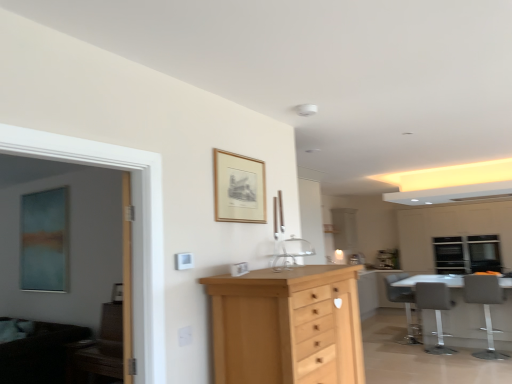
Question: Is there a large distance between transparent glass window at upper right and matte gray chair at lower right, placed as the 2th chair when sorted from back to front?

Choices:
 (A) no
 (B) yes

Answer: (B)

Question: Does transparent glass window at upper right appear on the left side of matte gray chair at lower right, placed as the 2th chair when sorted from back to front?

Choices:
 (A) no
 (B) yes

Answer: (A)

Question: Is transparent glass window at upper right at the right side of matte gray chair at lower right, placed as the 2th chair when sorted from back to front?

Choices:
 (A) yes
 (B) no

Answer: (A)

Question: Does transparent glass window at upper right have a greater height compared to matte gray chair at lower right, arranged as the 2th chair when viewed from the front?

Choices:
 (A) no
 (B) yes

Answer: (A)

Question: Is transparent glass window at upper right wider than matte gray chair at lower right, placed as the 2th chair when sorted from back to front?

Choices:
 (A) no
 (B) yes

Answer: (A)

Question: Considering the positions of wooden picture frame at upper center and clear glass sink at center in the image, is wooden picture frame at upper center wider or thinner than clear glass sink at center?

Choices:
 (A) thin
 (B) wide

Answer: (A)

Question: Considering their positions, is wooden picture frame at upper center located in front of or behind clear glass sink at center?

Choices:
 (A) behind
 (B) front

Answer: (B)

Question: From the image's perspective, is wooden picture frame at upper center positioned above or below clear glass sink at center?

Choices:
 (A) above
 (B) below

Answer: (A)

Question: Is wooden picture frame at upper center to the left or to the right of clear glass sink at center in the image?

Choices:
 (A) left
 (B) right

Answer: (A)

Question: Is point (289, 241) positioned closer to the camera than point (408, 225)?

Choices:
 (A) closer
 (B) farther

Answer: (A)

Question: In the image, is clear glass sink at center on the left side or the right side of white glossy cabinetry at right?

Choices:
 (A) right
 (B) left

Answer: (B)

Question: Is clear glass sink at center spatially inside white glossy cabinetry at right, or outside of it?

Choices:
 (A) inside
 (B) outside

Answer: (B)

Question: Considering the positions of clear glass sink at center and white glossy cabinetry at right in the image, is clear glass sink at center taller or shorter than white glossy cabinetry at right?

Choices:
 (A) short
 (B) tall

Answer: (A)

Question: Is gray fabric chair at lower right, the first chair from the front, inside the boundaries of white glossy cabinetry at right, or outside?

Choices:
 (A) outside
 (B) inside

Answer: (A)

Question: Considering the positions of gray fabric chair at lower right, the first chair from the front, and white glossy cabinetry at right in the image, is gray fabric chair at lower right, the first chair from the front, wider or thinner than white glossy cabinetry at right?

Choices:
 (A) thin
 (B) wide

Answer: (A)